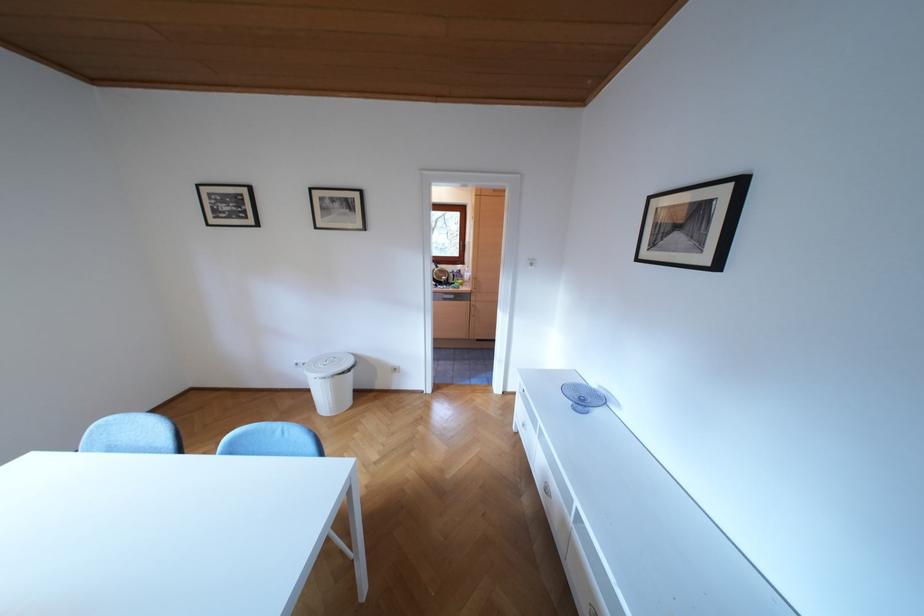
Identify the location of white drawer handle. (448, 294).